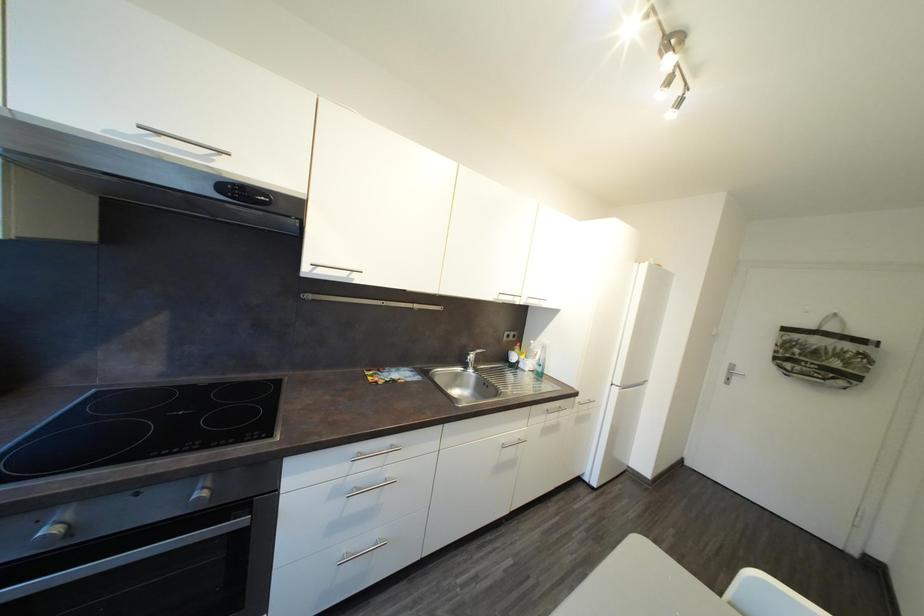
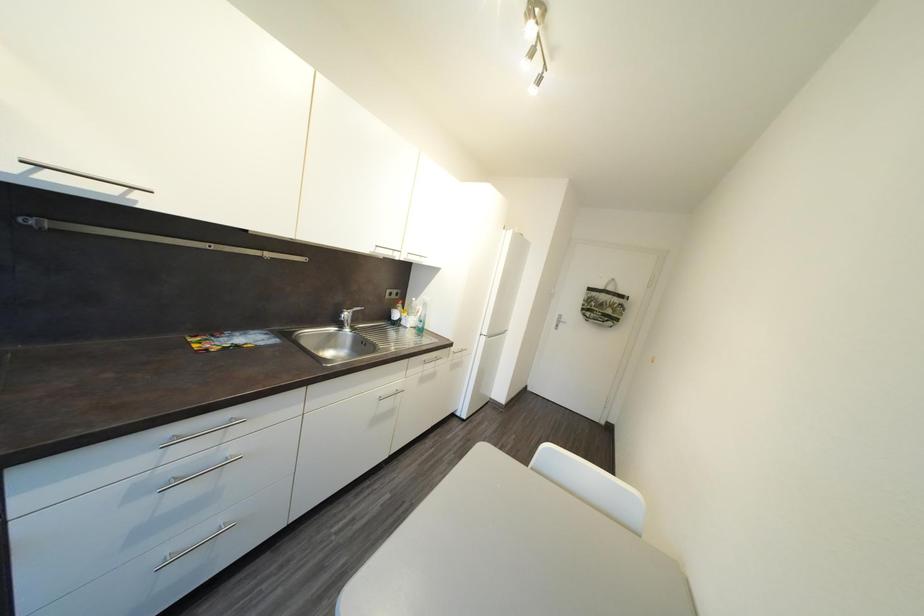
Question: The camera is either moving clockwise (left) or counter-clockwise (right) around the object. The first image is from the beginning of the video and the second image is from the end. Is the camera moving left or right when shooting the video?

Choices:
 (A) Left
 (B) Right

Answer: (A)